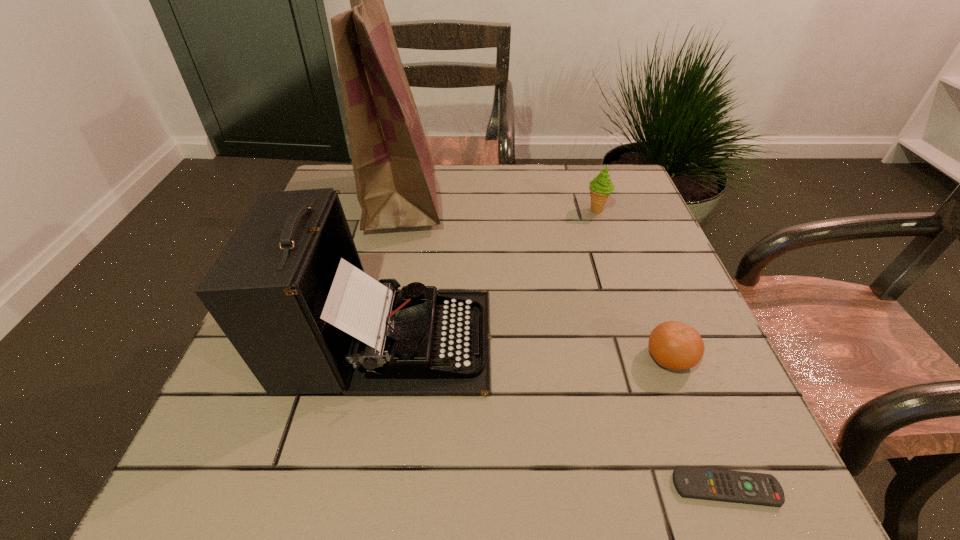
Where is `blank region between the fourth tallest object and the shortest object`? The width and height of the screenshot is (960, 540). blank region between the fourth tallest object and the shortest object is located at coordinates point(698,423).

Where is `vacant area between the tallest object and the clementine`? vacant area between the tallest object and the clementine is located at coordinates (536, 279).

Where is `vacant space that's between the fourth tallest object and the nearest object`? The image size is (960, 540). vacant space that's between the fourth tallest object and the nearest object is located at coordinates (698, 423).

Locate which object ranks in proximity to the tallest object. Please provide its 2D coordinates. Your answer should be formatted as a tuple, i.e. [(x, y)], where the tuple contains the x and y coordinates of a point satisfying the conditions above.

[(289, 291)]

You are a GUI agent. You are given a task and a screenshot of the screen. Output one action in this format:
    pyautogui.click(x=<x>, y=<y>)
    Task: Click on the fourth closest object to the grocery bag
    Image resolution: width=960 pixels, height=540 pixels.
    Given the screenshot: What is the action you would take?
    pyautogui.click(x=690, y=482)

The width and height of the screenshot is (960, 540). I want to click on vacant space that satisfies the following two spatial constraints: 1. on the front-facing side of the grocery bag; 2. on the left side of the second shortest object, so click(365, 358).

Locate an element on the screen. vacant space that satisfies the following two spatial constraints: 1. on the front side of the shortest object; 2. on the right side of the clementine is located at coordinates (720, 488).

Find the location of a particular element. Image resolution: width=960 pixels, height=540 pixels. vacant space that satisfies the following two spatial constraints: 1. on the front-facing side of the tallest object; 2. on the left side of the nearest object is located at coordinates (334, 488).

Image resolution: width=960 pixels, height=540 pixels. I want to click on free location that satisfies the following two spatial constraints: 1. on the front-facing side of the grocery bag; 2. on the back side of the fourth tallest object, so click(365, 358).

Find the location of a particular element. vacant point that satisfies the following two spatial constraints: 1. on the front side of the third shortest object; 2. inside the open case of the typewriter is located at coordinates (641, 340).